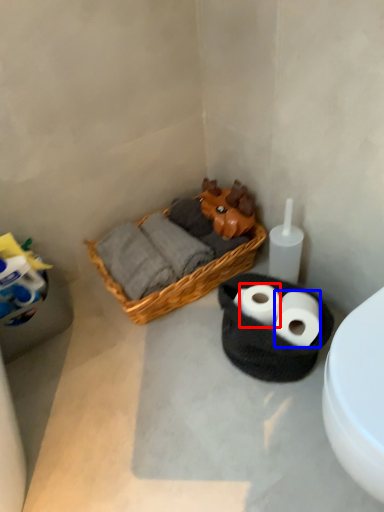
Question: Which point is further to the camera, toilet paper (highlighted by a red box) or toilet paper (highlighted by a blue box)?

Choices:
 (A) toilet paper
 (B) toilet paper

Answer: (A)